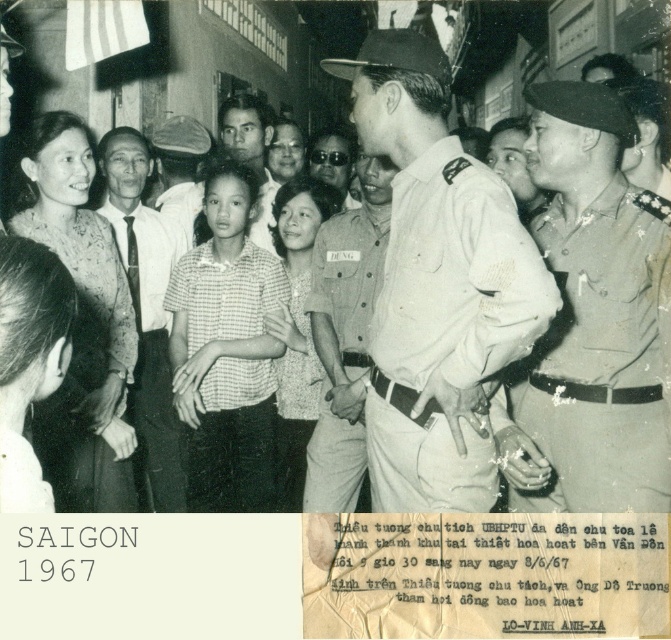
Can you confirm if checkered fabric shirt at center is positioned to the left of checkered fabric blouse at center?

Indeed, checkered fabric shirt at center is positioned on the left side of checkered fabric blouse at center.

Is point (234, 342) positioned before point (285, 355)?

Yes, point (234, 342) is closer to viewer.

Identify the location of checkered fabric shirt at center. (225, 349).

Is light brown uniform at center closer to camera compared to matte khaki uniform at center?

No.

Between light brown uniform at center and matte khaki uniform at center, which one has less height?

With less height is light brown uniform at center.

This screenshot has height=640, width=671. What do you see at coordinates (180, 170) in the screenshot? I see `light brown uniform at center` at bounding box center [180, 170].

The image size is (671, 640). Identify the location of light brown uniform at center. (180, 170).

Between white shirt at center and white textured shirt at center, which one appears on the right side from the viewer's perspective?

From the viewer's perspective, white textured shirt at center appears more on the right side.

What do you see at coordinates (146, 310) in the screenshot? I see `white shirt at center` at bounding box center [146, 310].

The width and height of the screenshot is (671, 640). Describe the element at coordinates (146, 310) in the screenshot. I see `white shirt at center` at that location.

The height and width of the screenshot is (640, 671). Find the location of `white shirt at center`. white shirt at center is located at coordinates (146, 310).